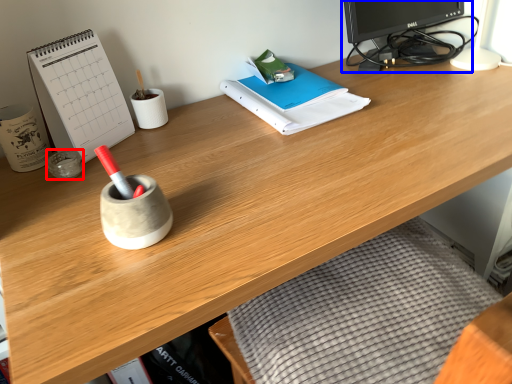
Question: Which object is further to the camera taking this photo, stationery (highlighted by a red box) or desktop computer (highlighted by a blue box)?

Choices:
 (A) stationery
 (B) desktop computer

Answer: (B)